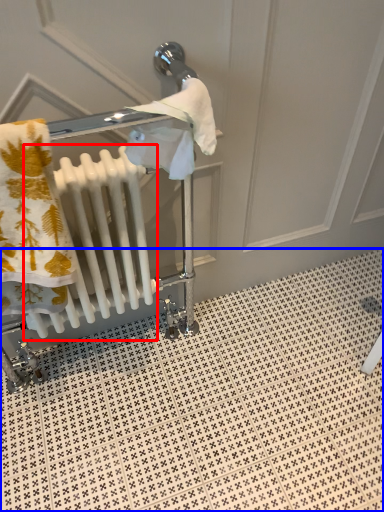
Question: Which object is further to the camera taking this photo, radiator (highlighted by a red box) or tile (highlighted by a blue box)?

Choices:
 (A) radiator
 (B) tile

Answer: (B)